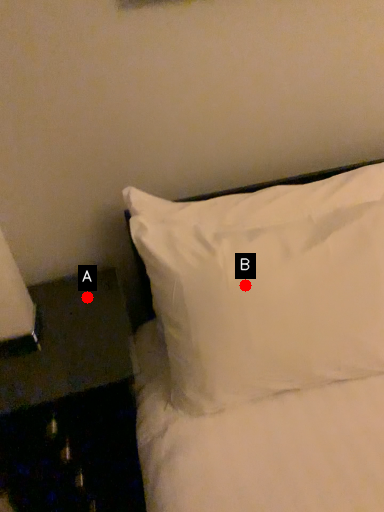
Question: Two points are circled on the image, labeled by A and B beside each circle. Which point is closer to the camera?

Choices:
 (A) A is closer
 (B) B is closer

Answer: (B)